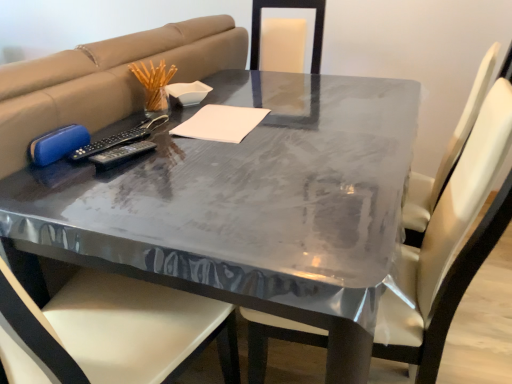
The image size is (512, 384). Identify the location of free spot behind black plastic remote at center. (134, 132).